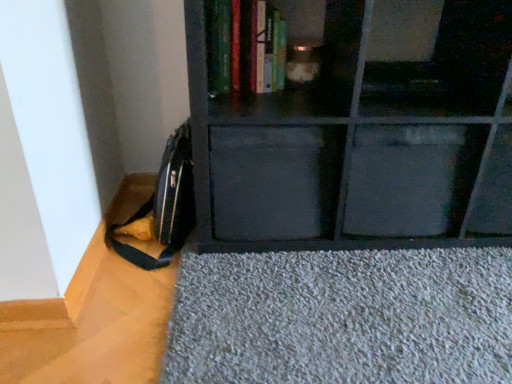
Question: Is black matte drawer at center, positioned as the second drawer in right-to-left order, in front of or behind matte black shelf at center in the image?

Choices:
 (A) behind
 (B) front

Answer: (A)

Question: Do you think black matte drawer at center, positioned as the first drawer in left-to-right order, is within matte black shelf at center, or outside of it?

Choices:
 (A) outside
 (B) inside

Answer: (B)

Question: Which is farther from the matte black shelf at center?

Choices:
 (A) metallic gray drawer at center, which is the second drawer in left-to-right order
 (B) hardcover book at upper center
 (C) black matte drawer at center, positioned as the first drawer in left-to-right order

Answer: (B)

Question: Which is nearer to the hardcover book at upper center?

Choices:
 (A) black matte drawer at center, positioned as the first drawer in left-to-right order
 (B) matte black shelf at center
 (C) metallic gray drawer at center, arranged as the first drawer when viewed from the right

Answer: (B)